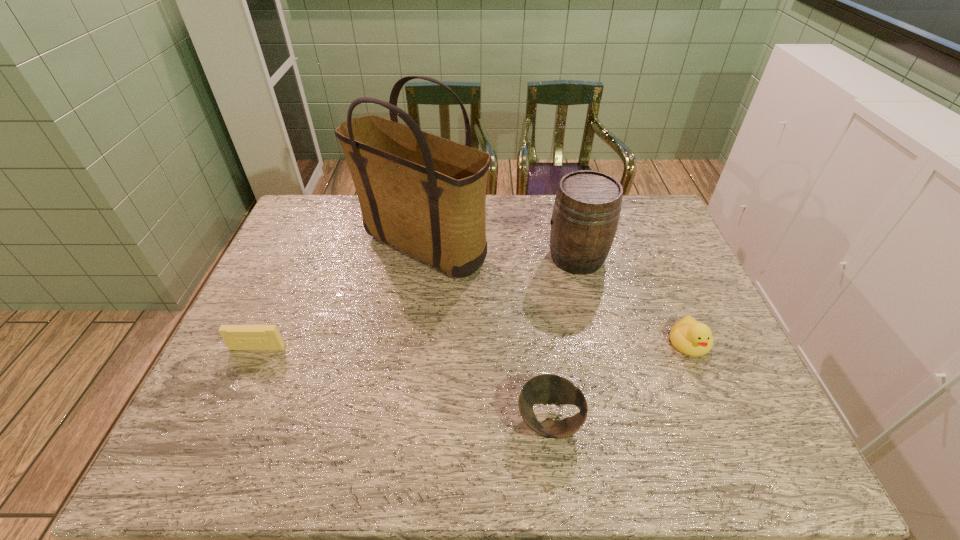
The width and height of the screenshot is (960, 540). I want to click on free region located 0.080m on the face of the rightmost object, so click(x=708, y=388).

The height and width of the screenshot is (540, 960). I want to click on vacant space situated at the front of the videotape with spools, so click(x=243, y=382).

What are the coordinates of `free space located 0.240m on the left of the nearest object` in the screenshot? It's located at (410, 421).

Locate an element on the screen. The height and width of the screenshot is (540, 960). object present at the far edge is located at coordinates (426, 195).

Where is `object present at the near edge`? The width and height of the screenshot is (960, 540). object present at the near edge is located at coordinates (544, 389).

Find the location of `object that is at the left edge`. object that is at the left edge is located at coordinates (237, 337).

This screenshot has width=960, height=540. I want to click on object situated at the right edge, so click(688, 336).

At what (x,y) coordinates should I click in order to perform the action: click on vacant area at the far edge of the desktop. Please return your answer as a coordinate pair (x, y). This screenshot has width=960, height=540. Looking at the image, I should click on (360, 210).

This screenshot has width=960, height=540. In order to click on blank space at the near edge in this screenshot , I will do `click(473, 440)`.

I want to click on vacant space at the right edge of the desktop, so click(755, 404).